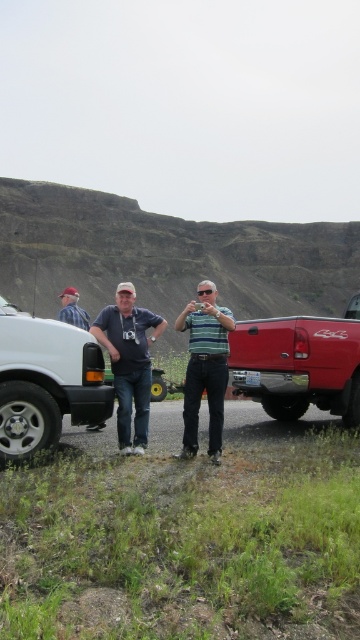
Does white matte van at left come in front of matte blue shirt at center?

→ Yes, it is.

Measure the distance between white matte van at left and camera.

white matte van at left is 6.05 meters away from camera.

Which is in front, point (96, 340) or point (123, 346)?

Point (96, 340) is in front.

The height and width of the screenshot is (640, 360). In order to click on white matte van at left in this screenshot , I will do `click(46, 381)`.

Does shiny red truck at right have a larger size compared to matte blue shirt at center?

Yes.

Who is positioned more to the right, shiny red truck at right or matte blue shirt at center?

shiny red truck at right

The width and height of the screenshot is (360, 640). Find the location of `shiny red truck at right`. shiny red truck at right is located at coordinates (299, 364).

Who is positioned more to the left, shiny red truck at right or striped cotton shirt at center?

From the viewer's perspective, striped cotton shirt at center appears more on the left side.

Who is taller, shiny red truck at right or striped cotton shirt at center?

Standing taller between the two is shiny red truck at right.

Is point (241, 364) more distant than point (191, 397)?

Yes, point (241, 364) is behind point (191, 397).

Identify the location of shiny red truck at right. (299, 364).